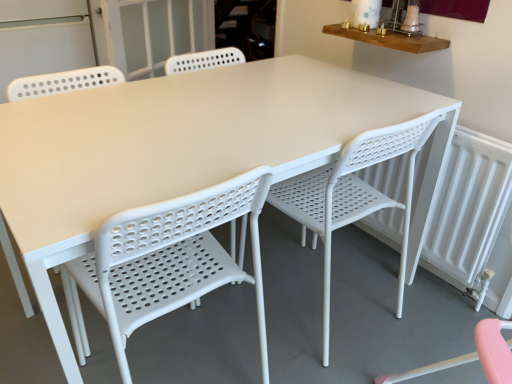
Image resolution: width=512 pixels, height=384 pixels. I want to click on free space between white plastic radiator at right and white plastic chair at center, placed as the 1th chair when sorted from right to left, so click(390, 291).